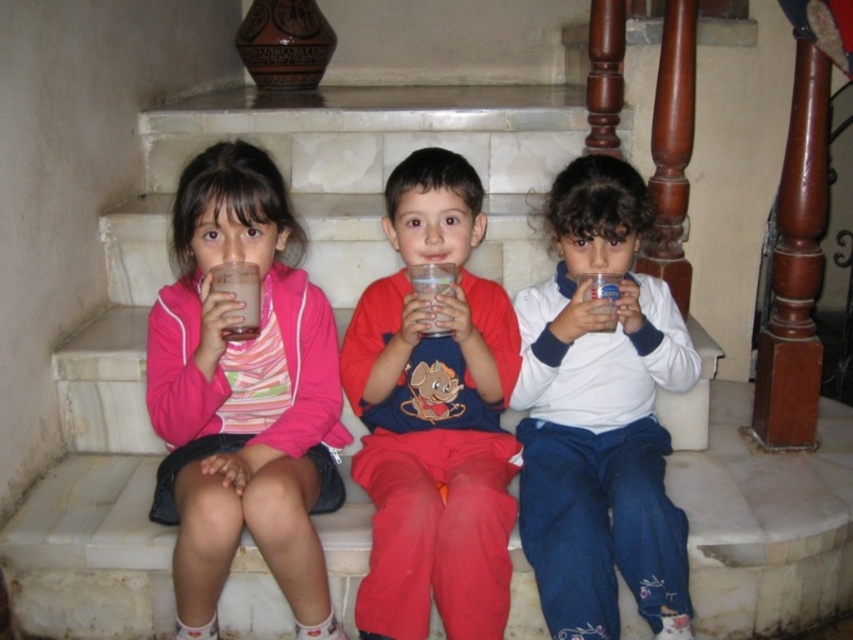
Question: Among these points, which one is farthest from the camera?

Choices:
 (A) (228, 285)
 (B) (190, 182)
 (C) (576, 328)
 (D) (426, 440)

Answer: (D)

Question: Estimate the real-world distances between objects in this image. Which object is farther from the transparent plastic cup at center?

Choices:
 (A) matte blue shirt at center
 (B) translucent plastic bottle at center
 (C) white matte shirt at center
 (D) milky white liquid at left

Answer: (C)

Question: Does transparent plastic cup at center appear on the left side of translucent plastic bottle at center?

Choices:
 (A) yes
 (B) no

Answer: (A)

Question: Which is farther from the pink matte jacket at center?

Choices:
 (A) white matte shirt at center
 (B) transparent plastic cup at center

Answer: (A)

Question: Is pink matte jacket at center bigger than white matte shirt at center?

Choices:
 (A) yes
 (B) no

Answer: (A)

Question: Is matte blue shirt at center smaller than translucent plastic bottle at center?

Choices:
 (A) no
 (B) yes

Answer: (A)